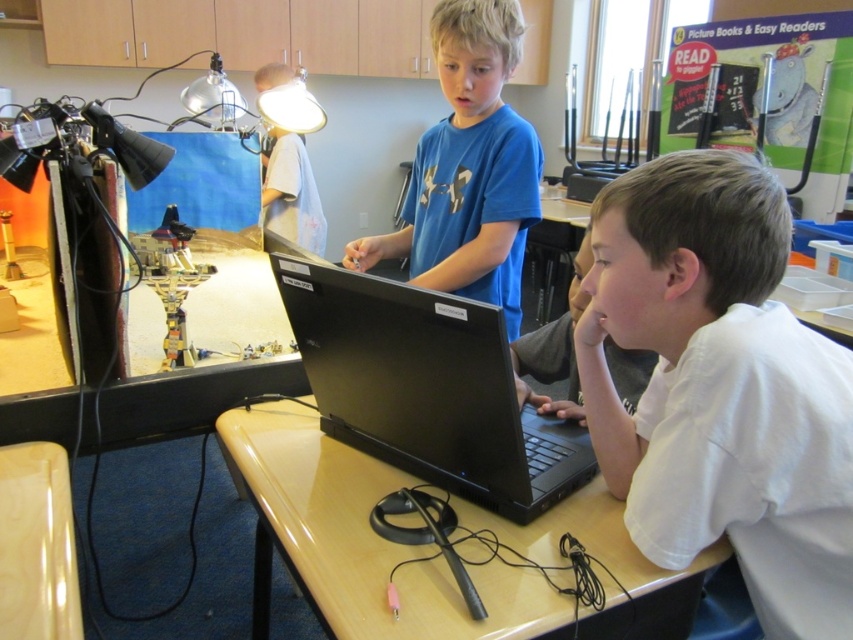
Does point (843, 461) come closer to viewer compared to point (421, 269)?

Yes, point (843, 461) is closer to viewer.

Find the location of a particular element. white matte shirt at lower right is located at coordinates (720, 388).

Who is more forward, [384,392] or [451,156]?

Point [384,392] is in front.

From the picture: Can you confirm if black matte laptop at center is positioned to the right of blue matte shirt at center?

No, black matte laptop at center is not to the right of blue matte shirt at center.

Image resolution: width=853 pixels, height=640 pixels. I want to click on black matte laptop at center, so click(x=427, y=388).

Can you confirm if glossy plastic table at center is positioned to the right of black matte laptop at center?

In fact, glossy plastic table at center is to the left of black matte laptop at center.

Which is more to the right, glossy plastic table at center or black matte laptop at center?

black matte laptop at center

Is point (468, 566) less distant than point (328, 387)?

Yes, it is in front of point (328, 387).

I want to click on glossy plastic table at center, so click(361, 541).